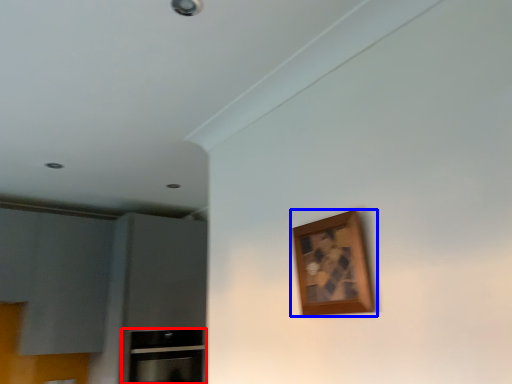
Question: Which point is further to the camera, cabinetry (highlighted by a red box) or picture frame (highlighted by a blue box)?

Choices:
 (A) cabinetry
 (B) picture frame

Answer: (A)